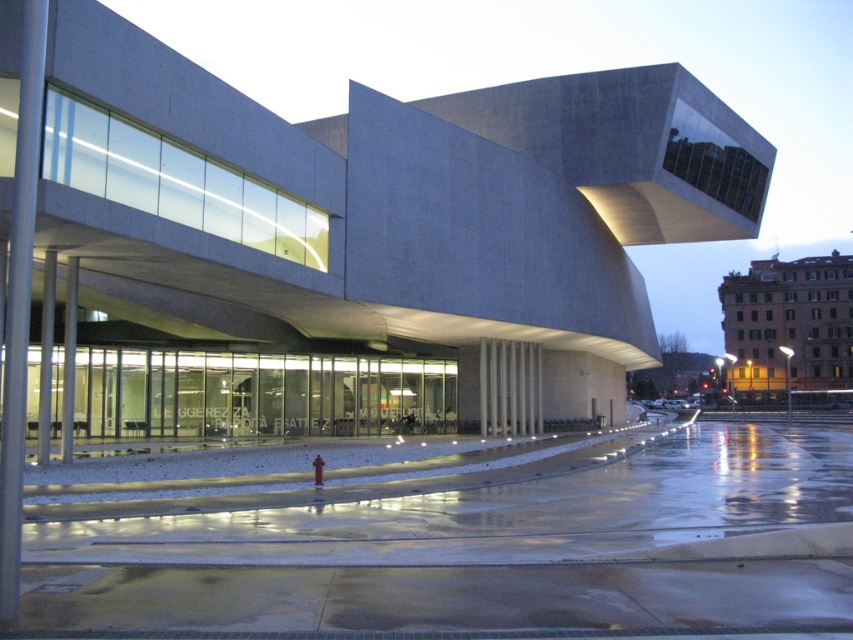
You are standing in front of the modern architectural structure. You notice the concrete building at center and the yellow brick building at right. Which building is positioned lower in the image?

The concrete building at center is positioned lower than the yellow brick building at right in the image.

You are standing at the origin point in the image coordinate system. Where is the concrete building at center located?

The concrete building at center is located at point (340, 237) in the image coordinate system.